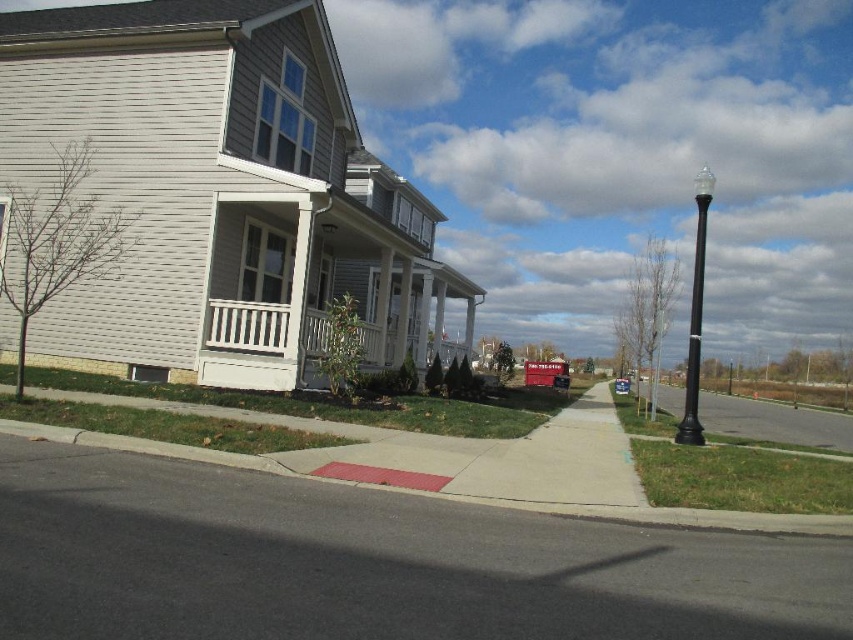
Based on the photo, can you confirm if white painted wood porch at center is smaller than metallic silver sedan at center?

Correct, white painted wood porch at center occupies less space than metallic silver sedan at center.

Who is more forward, (229, 321) or (621, 380)?

Point (229, 321) is more forward.

From the picture: Who is more forward, [216,378] or [624,388]?

Positioned in front is point [216,378].

At what (x,y) coordinates should I click in order to perform the action: click on white painted wood porch at center. Please return your answer as a coordinate pair (x, y). Looking at the image, I should click on (262, 346).

Is white painted wood porch at center positioned behind black polished metal streetlight at right?

Yes, white painted wood porch at center is further from the viewer.

Between point (381, 349) and point (698, 204), which one is positioned in front?

Positioned in front is point (698, 204).

The image size is (853, 640). In order to click on white painted wood porch at center in this screenshot , I will do `click(262, 346)`.

You are a GUI agent. You are given a task and a screenshot of the screen. Output one action in this format:
    pyautogui.click(x=<x>, y=<y>)
    Task: Click on the white painted wood porch at center
    This screenshot has height=640, width=853.
    Given the screenshot: What is the action you would take?
    pyautogui.click(x=262, y=346)

Between black asphalt at lower left and black polished metal streetlight at right, which one is positioned higher?

black polished metal streetlight at right

Between point (292, 493) and point (703, 269), which one is positioned in front?

Point (292, 493) is in front.

Between point (288, 520) and point (698, 378), which one is positioned in front?

Point (288, 520) is in front.

Identify the location of black asphalt at lower left. This screenshot has width=853, height=640. (370, 563).